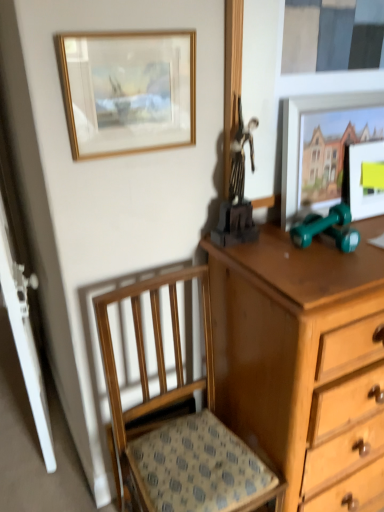
Question: Is shiny black statue at upper center, which is counted as the second toy, starting from the right, taller or shorter than wooden chair at lower left?

Choices:
 (A) short
 (B) tall

Answer: (A)

Question: Considering the positions of point (223, 216) and point (168, 480), is point (223, 216) closer or farther from the camera than point (168, 480)?

Choices:
 (A) closer
 (B) farther

Answer: (B)

Question: Which object is positioned farthest from the matte wooden picture frame at upper right, positioned as the 2th picture frame in right-to-left order?

Choices:
 (A) gold-framed painting at upper left, acting as the first picture frame starting from the left
 (B) matte wooden picture frame at upper right, the 1th picture frame when ordered from right to left
 (C) green rubber dumbbells at right, the second toy from the left
 (D) wooden chair at lower left
 (E) shiny black statue at upper center, arranged as the 1th toy when viewed from the left

Answer: (D)

Question: Based on their relative distances, which object is farther from the gold-framed painting at upper left, acting as the first picture frame starting from the left?

Choices:
 (A) green rubber dumbbells at right, the first toy viewed from the right
 (B) wooden chair at lower left
 (C) matte wooden picture frame at upper right, which is the third picture frame in left-to-right order
 (D) matte wooden picture frame at upper right, positioned as the 2th picture frame in right-to-left order
 (E) shiny black statue at upper center, which is counted as the second toy, starting from the right

Answer: (C)